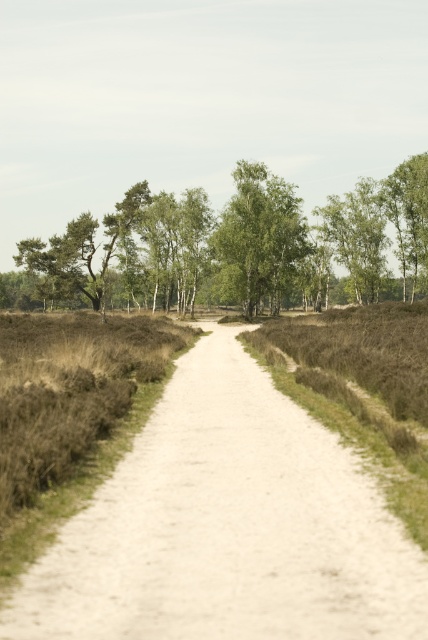
You are standing at the starting point of the sandy path in the landscape. You see two points marked on the path ahead of you. The first point is at coordinates point [207,563] and the second is at point [243,260]. Which point is closer to your current position?

Point [207,563] is in front of point [243,260], so the first point is closer to your current position.

You are a hiker standing at the starting point of the white gravel path at center and the green leafy tree at center. Which object is closer to you?

The white gravel path at center is closer to you because it is in front of the green leafy tree at center.